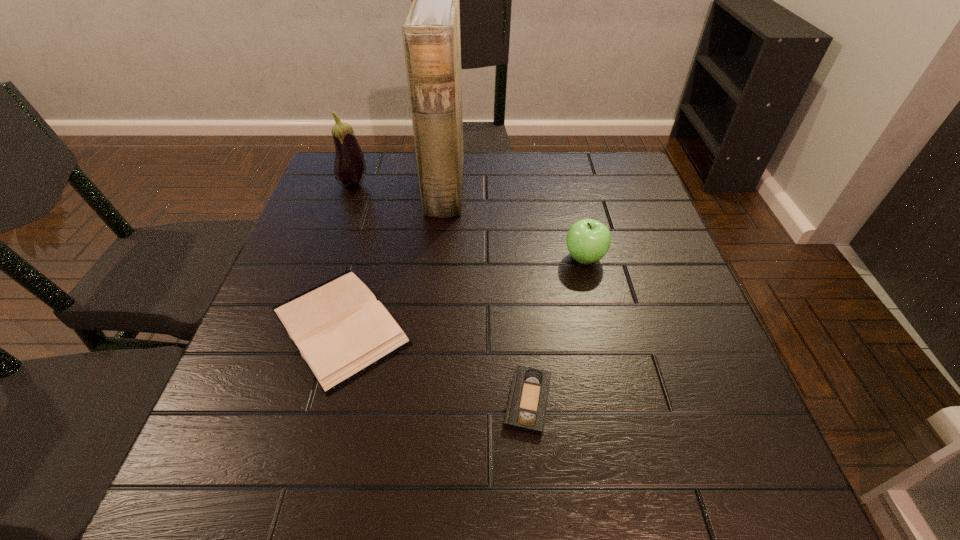
Identify the location of blank space located 0.210m on the right of the hardback book. The width and height of the screenshot is (960, 540). (517, 326).

The width and height of the screenshot is (960, 540). What are the coordinates of `vacant area situated 0.100m on the left of the fourth object from left to right` in the screenshot? It's located at (446, 401).

Identify the location of phonebook at the far edge. (431, 33).

Image resolution: width=960 pixels, height=540 pixels. I want to click on eggplant that is positioned at the far edge, so point(349,168).

Identify the location of eggplant present at the left edge. (349, 168).

Locate an element on the screen. hardback book located in the left edge section of the desktop is located at coordinates (341, 331).

Find the location of a particular element. This screenshot has width=960, height=540. object present at the right edge is located at coordinates (588, 240).

Image resolution: width=960 pixels, height=540 pixels. What are the coordinates of `object present at the far left corner` in the screenshot? It's located at (349, 168).

Where is `free region at the far edge of the desktop`? This screenshot has width=960, height=540. free region at the far edge of the desktop is located at coordinates (502, 170).

Identify the location of free spot at the near edge of the desktop. This screenshot has width=960, height=540. (366, 476).